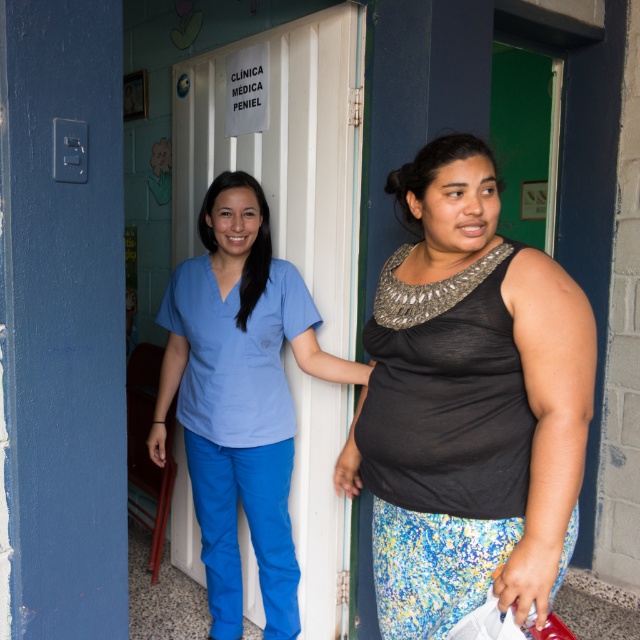
You are a photographer trying to capture a closeup shot of both the matte blue pants at lower left and the blue fabric scrub at center. Given their distance, do you think you can fit both into your camera frame without moving the camera? Please explain based on their separation distance.

The matte blue pants at lower left and blue fabric scrub at center are 32.37 inches apart. Depending on the camera lens and focal length, this distance may require a wider angle lens to capture both subjects in frame without moving the camera. If the camera has sufficient zoom capabilities, adjusting the focal length could also help include both objects within the frame.

You are a visitor at the CLINICA MEDICA PENIEL and need to find the medical staff. Based on the image, which object is closer to the entrance door? The matte blue pants at lower left or the blue fabric scrub at center?

The blue fabric scrub at center is closer to the entrance door because the matte blue pants at lower left is below it, indicating it is positioned lower and possibly further away.

You are standing at the entrance of the CLINICA MEDI PENIEL and want to take a photo of the two people. The person on the left is in blue medical scrubs, and the person on the right is wearing a black sleeveless top. There are two points marked in the image at coordinates point [486,390] and point [211,468]. Which point is nearer to you when you take the photo?

Point [486,390] is closer to the camera than point [211,468].